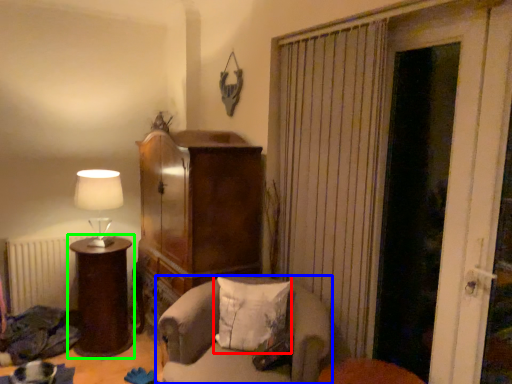
Question: Estimate the real-world distances between objects in this image. Which object is farther from pillow (highlighted by a red box), chair (highlighted by a blue box) or furniture (highlighted by a green box)?

Choices:
 (A) chair
 (B) furniture

Answer: (B)